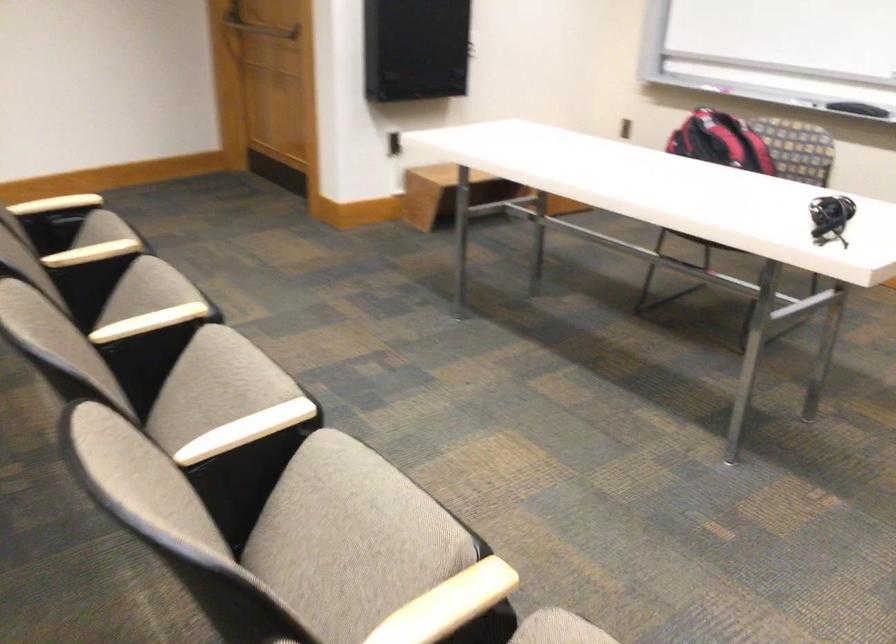
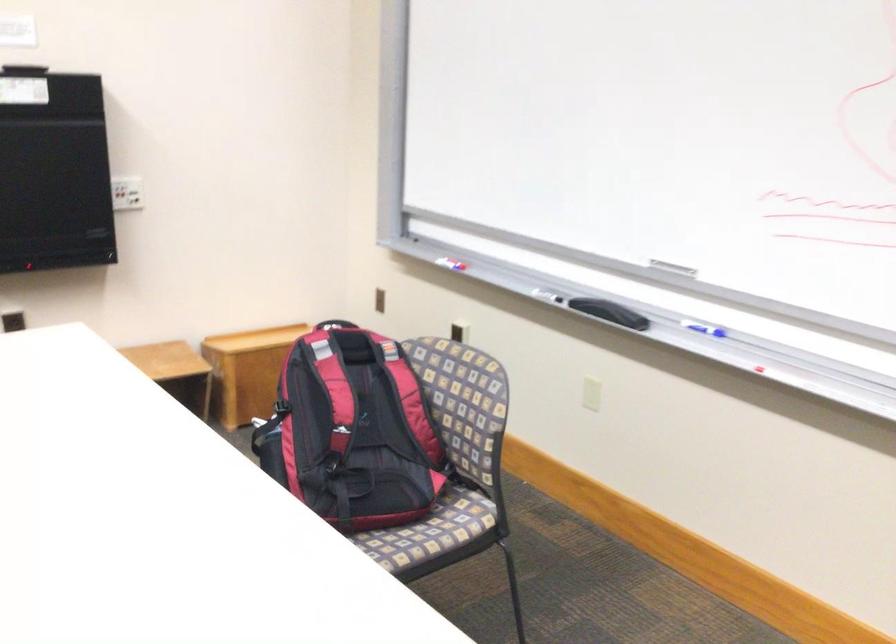
Locate, in the second image, the point that corresponds to pixel 726 75 in the first image.

(451, 261)